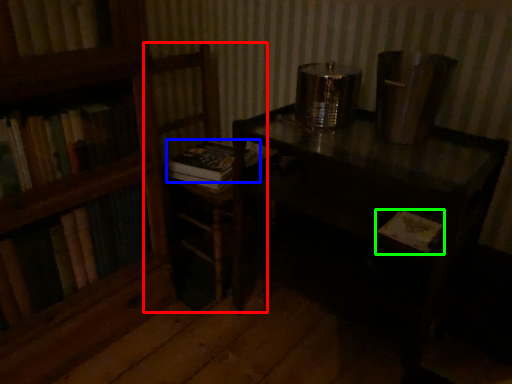
Question: Considering the real-world distances, which object is closest to armchair (highlighted by a red box)? book (highlighted by a blue box) or book (highlighted by a green box).

Choices:
 (A) book
 (B) book

Answer: (A)